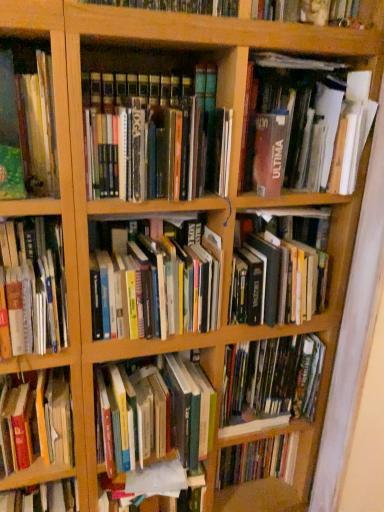
Question: Does hardcover book at left, the 9th book in the top-to-bottom sequence, have a larger size compared to hardcover book at left, which is counted as the 4th book, starting from the bottom?

Choices:
 (A) no
 (B) yes

Answer: (B)

Question: Can you confirm if hardcover book at left, the 1th book ordered from the bottom, is smaller than hardcover book at left, which appears as the 6th book when viewed from the top?

Choices:
 (A) no
 (B) yes

Answer: (A)

Question: Is hardcover book at left, the 1th book ordered from the bottom, looking in the opposite direction of hardcover book at left, which appears as the 6th book when viewed from the top?

Choices:
 (A) yes
 (B) no

Answer: (B)

Question: From a real-world perspective, is hardcover book at left, the 9th book in the top-to-bottom sequence, on hardcover book at left, which is counted as the 4th book, starting from the bottom?

Choices:
 (A) no
 (B) yes

Answer: (A)

Question: Considering the relative positions of hardcover book at left, the 1th book ordered from the bottom, and hardcover book at left, which appears as the 6th book when viewed from the top, in the image provided, is hardcover book at left, the 1th book ordered from the bottom, to the left of hardcover book at left, which appears as the 6th book when viewed from the top, from the viewer's perspective?

Choices:
 (A) no
 (B) yes

Answer: (B)

Question: Is hardcover book at left, the 1th book ordered from the bottom, at the right side of hardcover book at left, which appears as the 6th book when viewed from the top?

Choices:
 (A) no
 (B) yes

Answer: (A)

Question: Can you confirm if hardcover books at center, which is the 5th book from bottom to top, is smaller than matte brown book at upper right, which is counted as the first book, starting from the top?

Choices:
 (A) yes
 (B) no

Answer: (A)

Question: Is there a large distance between hardcover books at center, the 5th book positioned from the top, and matte brown book at upper right, which is counted as the first book, starting from the top?

Choices:
 (A) yes
 (B) no

Answer: (B)

Question: Is hardcover books at center, the 5th book positioned from the top, turned away from matte brown book at upper right, the ninth book ordered from the bottom?

Choices:
 (A) no
 (B) yes

Answer: (A)

Question: Are hardcover books at center, the 5th book positioned from the top, and matte brown book at upper right, which is counted as the first book, starting from the top, beside each other?

Choices:
 (A) yes
 (B) no

Answer: (B)

Question: Is matte brown book at upper right, which is counted as the first book, starting from the top, inside hardcover books at center, which is the 5th book from bottom to top?

Choices:
 (A) yes
 (B) no

Answer: (B)

Question: Considering the relative positions of hardcover books at center, the 5th book positioned from the top, and matte brown book at upper right, the ninth book ordered from the bottom, in the image provided, is hardcover books at center, the 5th book positioned from the top, in front of matte brown book at upper right, the ninth book ordered from the bottom,?

Choices:
 (A) no
 (B) yes

Answer: (A)

Question: Would you consider matte brown book at upper right, which is counted as the first book, starting from the top, to be distant from green matte book at left, positioned as the 8th book in bottom-to-top order?

Choices:
 (A) no
 (B) yes

Answer: (A)